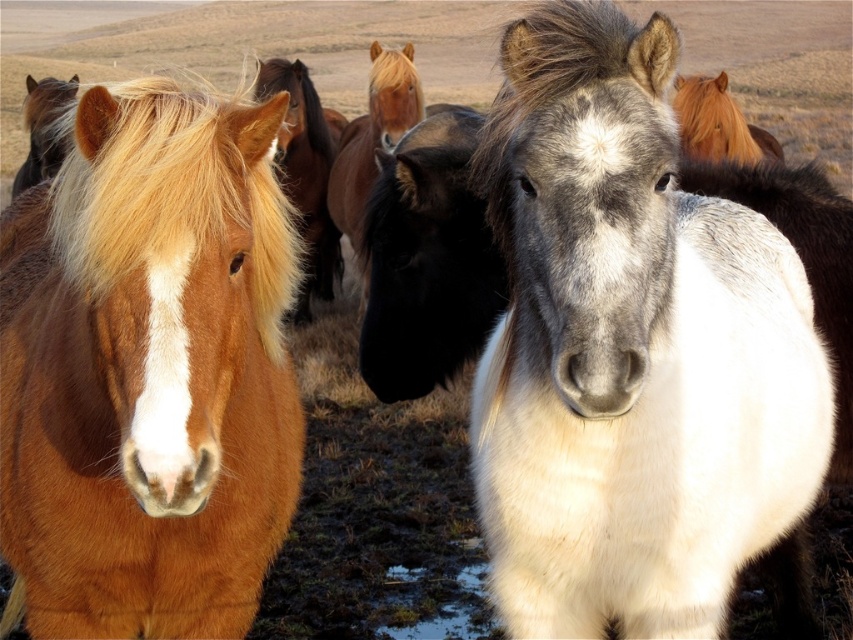
Question: Is shiny brown horse at left below brown glossy horse at center?

Choices:
 (A) yes
 (B) no

Answer: (A)

Question: Is white-gray fur horse at center thinner than brown grassland at center?

Choices:
 (A) no
 (B) yes

Answer: (B)

Question: Which object is farther from the camera taking this photo?

Choices:
 (A) golden-brown mane at left
 (B) shiny brown horse at left
 (C) golden-brown mane at upper right

Answer: (A)

Question: Which point is farther to the camera?

Choices:
 (A) (779, 161)
 (B) (329, 272)
 (C) (817, 58)

Answer: (C)

Question: Can you confirm if brown glossy horse at center is positioned above golden-brown mane at upper right?

Choices:
 (A) no
 (B) yes

Answer: (B)

Question: Among these objects, which one is nearest to the camera?

Choices:
 (A) white-gray fur horse at center
 (B) brown glossy horse at center

Answer: (A)